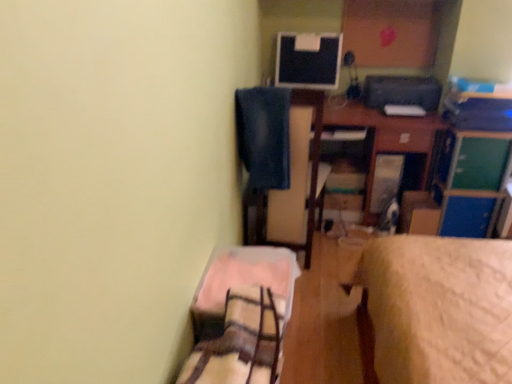
Question: Is blue fabric swivel chair at upper center outside of plaid fabric bed at lower left?

Choices:
 (A) yes
 (B) no

Answer: (A)

Question: Is blue fabric swivel chair at upper center facing towards plaid fabric bed at lower left?

Choices:
 (A) no
 (B) yes

Answer: (A)

Question: Can you confirm if blue fabric swivel chair at upper center is thinner than plaid fabric bed at lower left?

Choices:
 (A) yes
 (B) no

Answer: (B)

Question: Is blue fabric swivel chair at upper center bigger than plaid fabric bed at lower left?

Choices:
 (A) yes
 (B) no

Answer: (A)

Question: Is blue fabric swivel chair at upper center placed right next to plaid fabric bed at lower left?

Choices:
 (A) no
 (B) yes

Answer: (A)

Question: Is blue fabric swivel chair at upper center positioned before plaid fabric bed at lower left?

Choices:
 (A) no
 (B) yes

Answer: (A)

Question: From a real-world perspective, does green matte file cabinet at upper right sit lower than wooden desk at center?

Choices:
 (A) yes
 (B) no

Answer: (B)

Question: From the image's perspective, does green matte file cabinet at upper right appear higher than wooden desk at center?

Choices:
 (A) yes
 (B) no

Answer: (B)

Question: Can you see green matte file cabinet at upper right touching wooden desk at center?

Choices:
 (A) yes
 (B) no

Answer: (B)

Question: Is green matte file cabinet at upper right wider than wooden desk at center?

Choices:
 (A) yes
 (B) no

Answer: (B)

Question: Is green matte file cabinet at upper right positioned with its back to wooden desk at center?

Choices:
 (A) no
 (B) yes

Answer: (A)

Question: Is green matte file cabinet at upper right taller than wooden desk at center?

Choices:
 (A) yes
 (B) no

Answer: (B)

Question: Considering the relative sizes of wooden desk at center and blue fabric swivel chair at upper center in the image provided, is wooden desk at center smaller than blue fabric swivel chair at upper center?

Choices:
 (A) no
 (B) yes

Answer: (A)